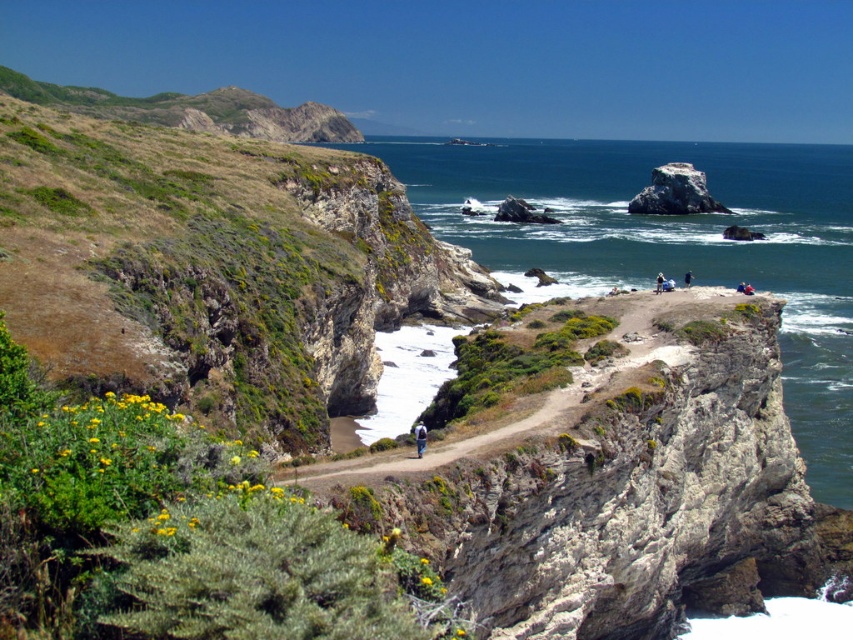
Does brown fabric backpack at center appear on the right side of white fabric at center?

No, brown fabric backpack at center is not to the right of white fabric at center.

Measure the distance between brown fabric backpack at center and white fabric at center.

120.26 feet

Where is `brown fabric backpack at center`? brown fabric backpack at center is located at coordinates (421, 436).

How far apart are green grassy cliff at center-left and white fabric at center?

A distance of 108.28 feet exists between green grassy cliff at center-left and white fabric at center.

Between point (262, 371) and point (659, 276), which one is positioned in front?

Point (262, 371)

Locate an element on the screen. green grassy cliff at center-left is located at coordinates (213, 268).

Is smooth gray rock at upper right positioned behind brown fabric backpack at center?

Yes.

The height and width of the screenshot is (640, 853). What are the coordinates of `smooth gray rock at upper right` in the screenshot? It's located at (675, 193).

Is point (660, 202) farther from viewer compared to point (425, 426)?

That is True.

This screenshot has width=853, height=640. In order to click on smooth gray rock at upper right in this screenshot , I will do `click(675, 193)`.